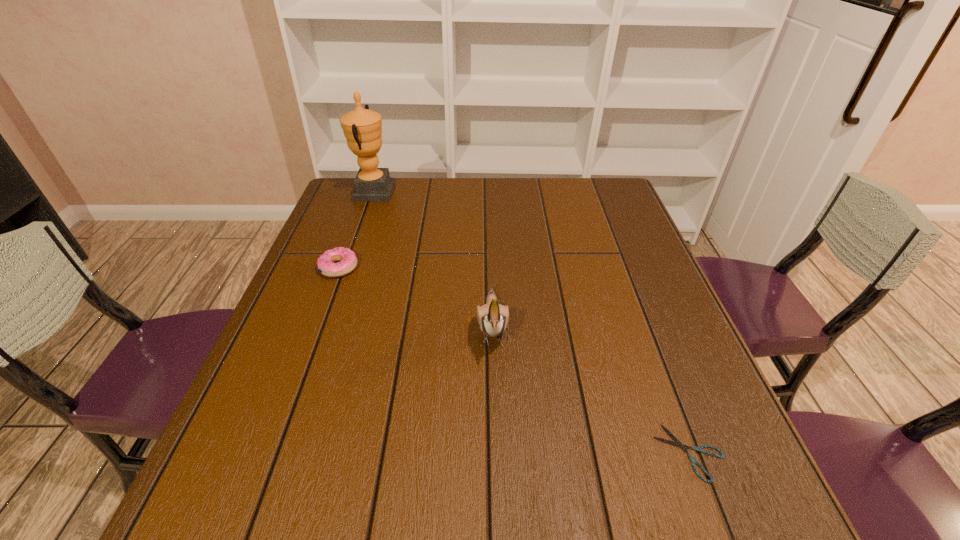
Locate an element on the screen. vacant region that satisfies the following two spatial constraints: 1. at the face of the nearest object; 2. on the right side of the second nearest object is located at coordinates (495, 453).

Image resolution: width=960 pixels, height=540 pixels. Identify the location of vacant region that satisfies the following two spatial constraints: 1. on the front side of the doughnut; 2. on the left side of the shortest object. (270, 453).

Identify the location of free space that satisfies the following two spatial constraints: 1. at the front of the shears with handles; 2. on the right side of the award. (281, 453).

Find the location of a particular element. This screenshot has width=960, height=540. vacant area that satisfies the following two spatial constraints: 1. at the front of the rightmost object with handles; 2. on the right side of the farthest object is located at coordinates (281, 453).

Where is `vacant position in the image that satisfies the following two spatial constraints: 1. at the face of the rightmost object; 2. on the right side of the third farthest object`? vacant position in the image that satisfies the following two spatial constraints: 1. at the face of the rightmost object; 2. on the right side of the third farthest object is located at coordinates (495, 453).

Identify the location of vacant space that satisfies the following two spatial constraints: 1. on the back side of the nearest object; 2. at the front of the farthest object with handles. Image resolution: width=960 pixels, height=540 pixels. (592, 192).